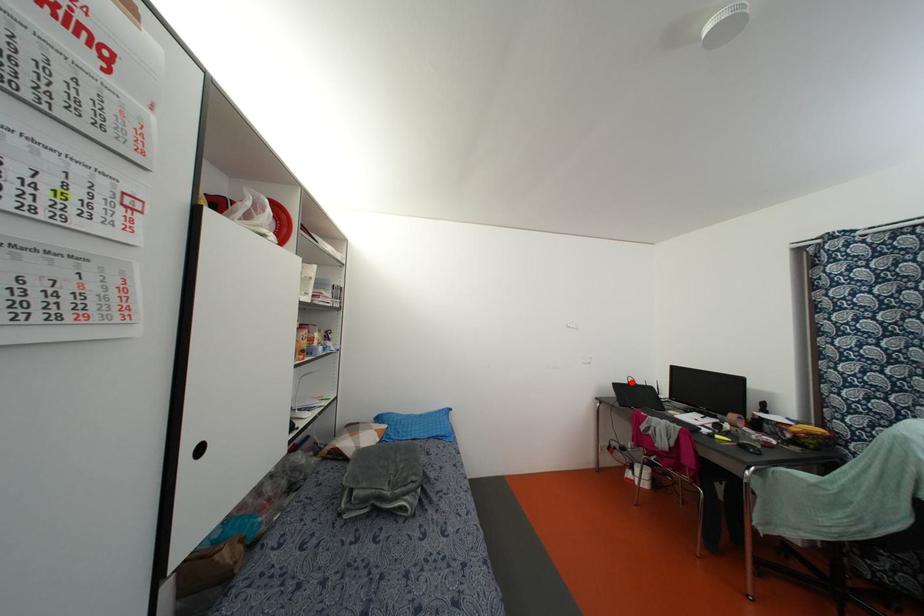
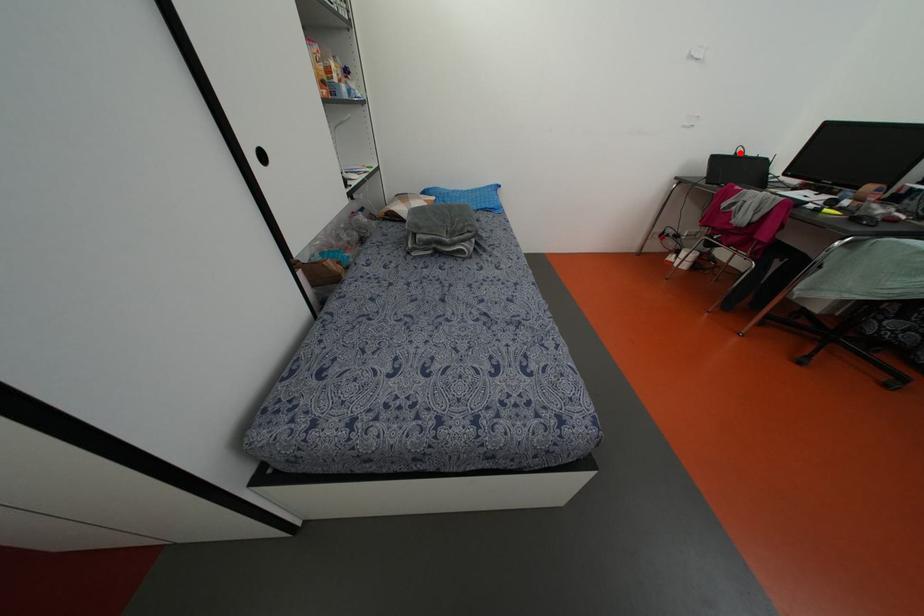
Consider the image. I am providing you with two images of the same scene from different viewpoints. A red point is marked on the first image and another point is marked on the second image. Is the red point in image1 aligned with the point shown in image2?

Yes